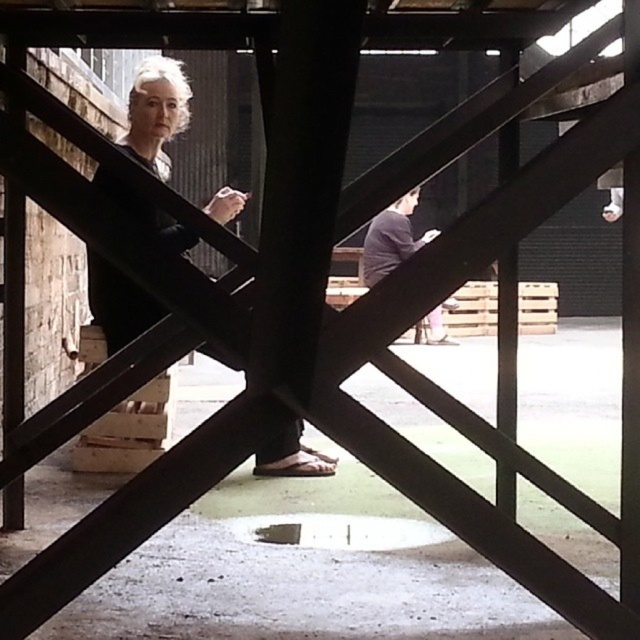
Can you confirm if dark brown leather jacket at center is smaller than wooden at lower left?

Incorrect, dark brown leather jacket at center is not smaller in size than wooden at lower left.

Who is more forward, (106, 262) or (124, 406)?

Point (106, 262) is in front.

Identify the location of dark brown leather jacket at center. (156, 112).

Between point (84, 458) and point (445, 337), which one is positioned in front?

Point (84, 458) is in front.

At what (x,y) coordinates should I click in order to perform the action: click on wooden at lower left. Please return your answer as a coordinate pair (x, y). The image size is (640, 640). Looking at the image, I should click on (129, 432).

Can you confirm if dark brown leather jacket at center is taller than dark gray sweater at center?

Yes, dark brown leather jacket at center is taller than dark gray sweater at center.

Does dark brown leather jacket at center come in front of dark gray sweater at center?

Yes, it is in front of dark gray sweater at center.

Identify the location of dark brown leather jacket at center. The width and height of the screenshot is (640, 640). pos(156,112).